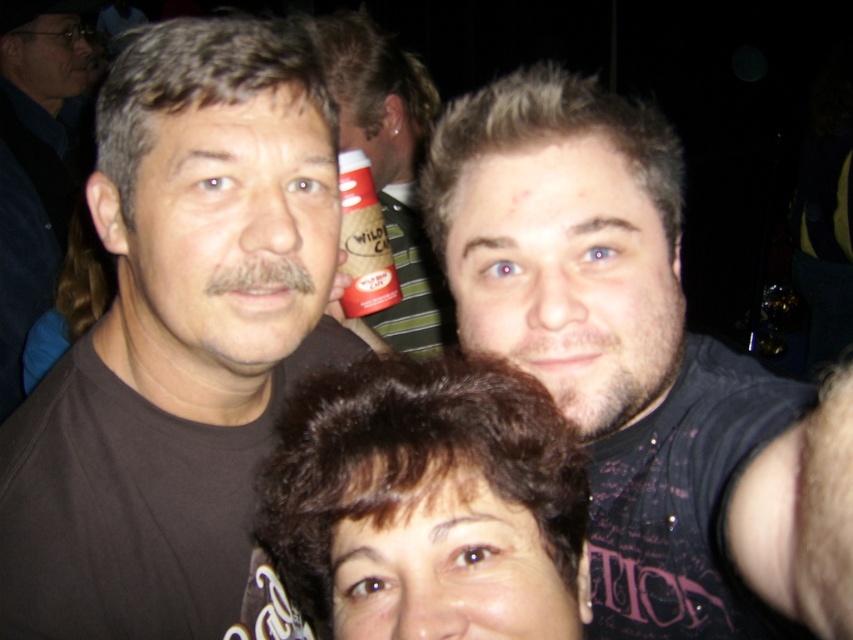
Can you confirm if brown shirt at left is smaller than red plastic cup at center?

No.

What are the coordinates of `brown shirt at left` in the screenshot? It's located at (33, 164).

This screenshot has width=853, height=640. In order to click on brown shirt at left in this screenshot , I will do `click(33, 164)`.

Can you confirm if brown matte shirt at upper left is smaller than red plastic cup at center?

Yes, brown matte shirt at upper left is smaller than red plastic cup at center.

Where is `brown matte shirt at upper left`? brown matte shirt at upper left is located at coordinates pyautogui.click(x=180, y=346).

Find the location of a particular element. matte black shirt at center is located at coordinates (636, 364).

Looking at this image, can you confirm if matte black shirt at center is smaller than red plastic cup at center?

Yes, matte black shirt at center is smaller than red plastic cup at center.

Locate an element on the screen. matte black shirt at center is located at coordinates (636, 364).